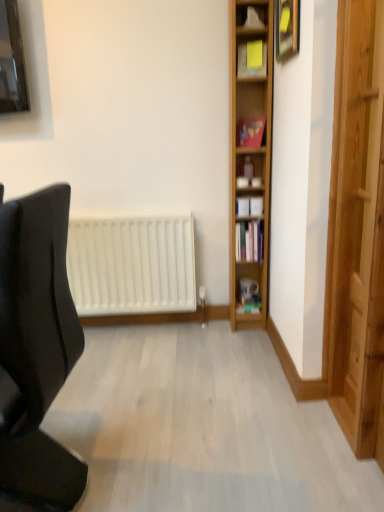
Question: Should I look upward or downward to see matte gold picture frame at upper right?

Choices:
 (A) down
 (B) up

Answer: (B)

Question: Considering the relative sizes of yellow paper at upper center, the first shelf viewed from the top, and matte gold picture frame at upper right in the image provided, is yellow paper at upper center, the first shelf viewed from the top, taller than matte gold picture frame at upper right?

Choices:
 (A) no
 (B) yes

Answer: (A)

Question: From the image's perspective, is yellow paper at upper center, acting as the 2th shelf starting from the bottom, above matte gold picture frame at upper right?

Choices:
 (A) yes
 (B) no

Answer: (B)

Question: Is yellow paper at upper center, the first shelf viewed from the top, next to matte gold picture frame at upper right and touching it?

Choices:
 (A) no
 (B) yes

Answer: (A)

Question: Is yellow paper at upper center, the first shelf viewed from the top, to the left of matte gold picture frame at upper right from the viewer's perspective?

Choices:
 (A) yes
 (B) no

Answer: (A)

Question: Considering the relative sizes of yellow paper at upper center, acting as the 2th shelf starting from the bottom, and matte gold picture frame at upper right in the image provided, is yellow paper at upper center, acting as the 2th shelf starting from the bottom, smaller than matte gold picture frame at upper right?

Choices:
 (A) yes
 (B) no

Answer: (A)

Question: Is yellow paper at upper center, the first shelf viewed from the top, wider than matte gold picture frame at upper right?

Choices:
 (A) no
 (B) yes

Answer: (B)

Question: Can you confirm if black matte chair at left is positioned to the left of yellow paper at upper center, the first shelf viewed from the top?

Choices:
 (A) no
 (B) yes

Answer: (B)

Question: Is black matte chair at left at the right side of yellow paper at upper center, the first shelf viewed from the top?

Choices:
 (A) no
 (B) yes

Answer: (A)

Question: Can you confirm if black matte chair at left is taller than yellow paper at upper center, acting as the 2th shelf starting from the bottom?

Choices:
 (A) yes
 (B) no

Answer: (A)

Question: Does black matte chair at left have a lesser width compared to yellow paper at upper center, acting as the 2th shelf starting from the bottom?

Choices:
 (A) no
 (B) yes

Answer: (A)

Question: Is black matte chair at left far from yellow paper at upper center, acting as the 2th shelf starting from the bottom?

Choices:
 (A) no
 (B) yes

Answer: (B)

Question: From a real-world perspective, is black matte chair at left physically above yellow paper at upper center, the first shelf viewed from the top?

Choices:
 (A) yes
 (B) no

Answer: (B)

Question: Is black matte chair at left completely or partially outside of hardcover book at center-right, arranged as the 2th book when viewed from the back?

Choices:
 (A) yes
 (B) no

Answer: (A)